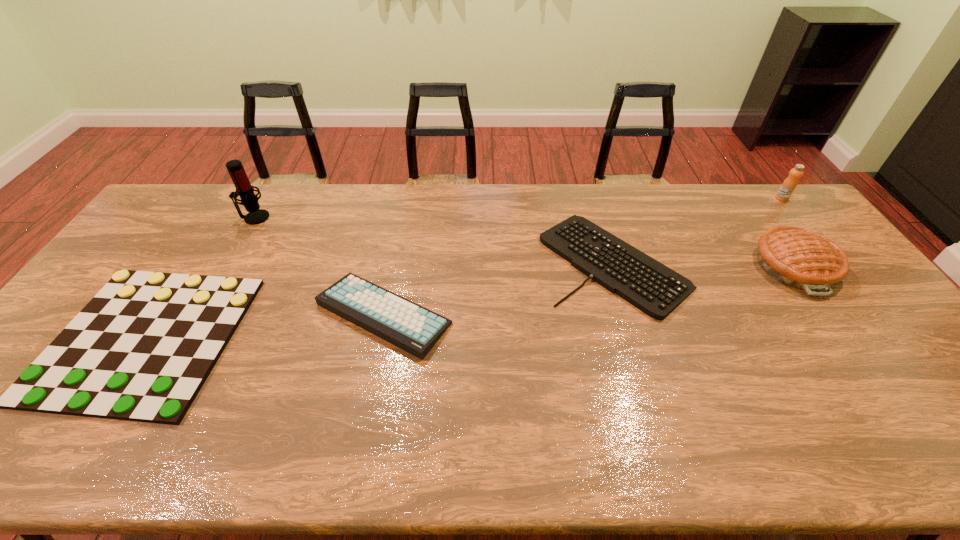
Identify the location of microphone. Image resolution: width=960 pixels, height=540 pixels. (249, 200).

You are a GUI agent. You are given a task and a screenshot of the screen. Output one action in this format:
    pyautogui.click(x=<x>, y=<y>)
    Task: Click on the orange juice
    
    Given the screenshot: What is the action you would take?
    (x=790, y=183)

Locate an element on the screen. the second tallest object is located at coordinates (790, 183).

Identify the location of pie. This screenshot has height=540, width=960. (799, 258).

Locate an element on the screen. the fourth object from right to left is located at coordinates (415, 329).

At what (x,y) coordinates should I click in order to perform the action: click on the left computer keyboard. Please return your answer as a coordinate pair (x, y). Looking at the image, I should click on [x=415, y=329].

Locate an element on the screen. The height and width of the screenshot is (540, 960). the right computer keyboard is located at coordinates (655, 289).

Identify the location of the fourth object from left to right. (655, 289).

The height and width of the screenshot is (540, 960). I want to click on vacant region located 0.090m on the back of the microphone, so click(267, 195).

Find the location of a particular element. The height and width of the screenshot is (540, 960). free space located on the front label of the farthest object is located at coordinates (812, 237).